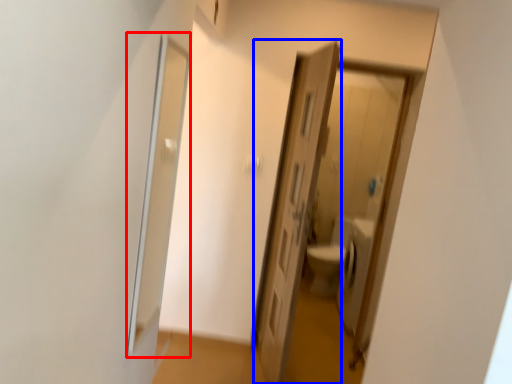
Question: Which object appears closest to the camera in this image, screen door (highlighted by a red box) or door (highlighted by a blue box)?

Choices:
 (A) screen door
 (B) door

Answer: (A)